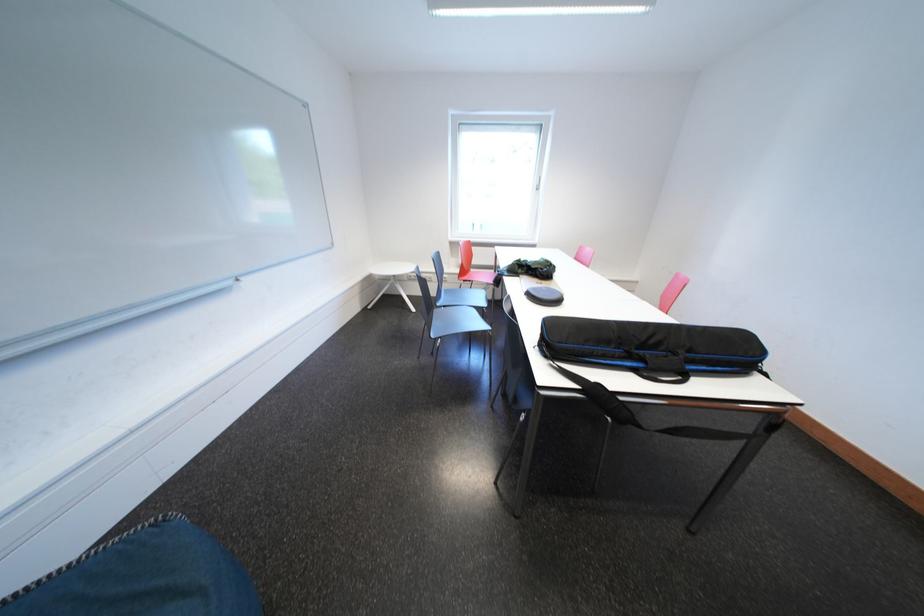
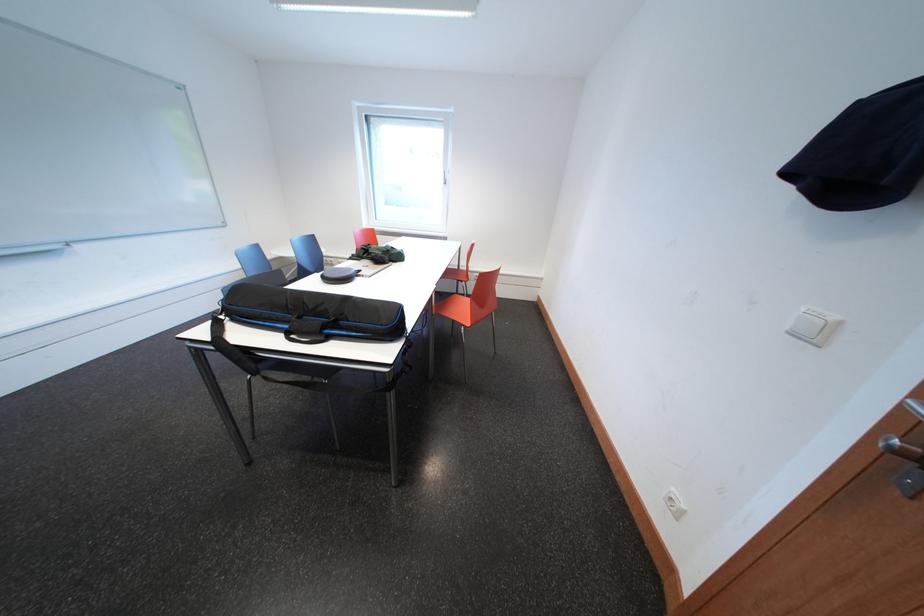
Question: What movement of the cameraman would produce the second image?

Choices:
 (A) Left
 (B) Right
 (C) Forward
 (D) Backward

Answer: (B)